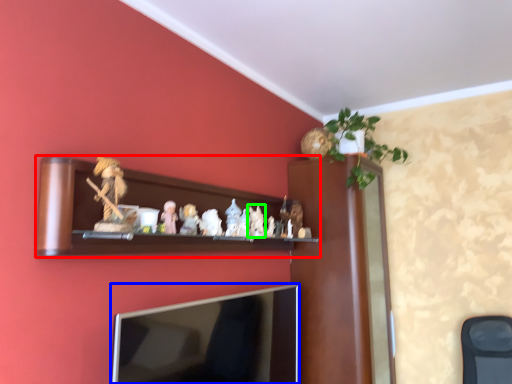
Question: Based on their relative distances, which object is farther from shelf (highlighted by a red box)? Choose from television (highlighted by a blue box) and toy (highlighted by a green box).

Choices:
 (A) television
 (B) toy

Answer: (B)